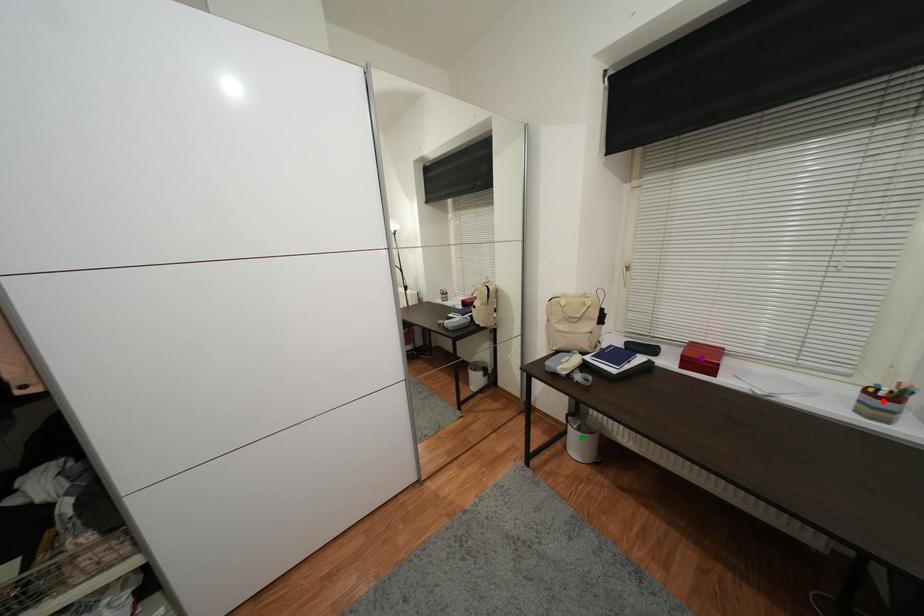
Order these from nearest to farthest:
purple point
red point
green point

red point < purple point < green point